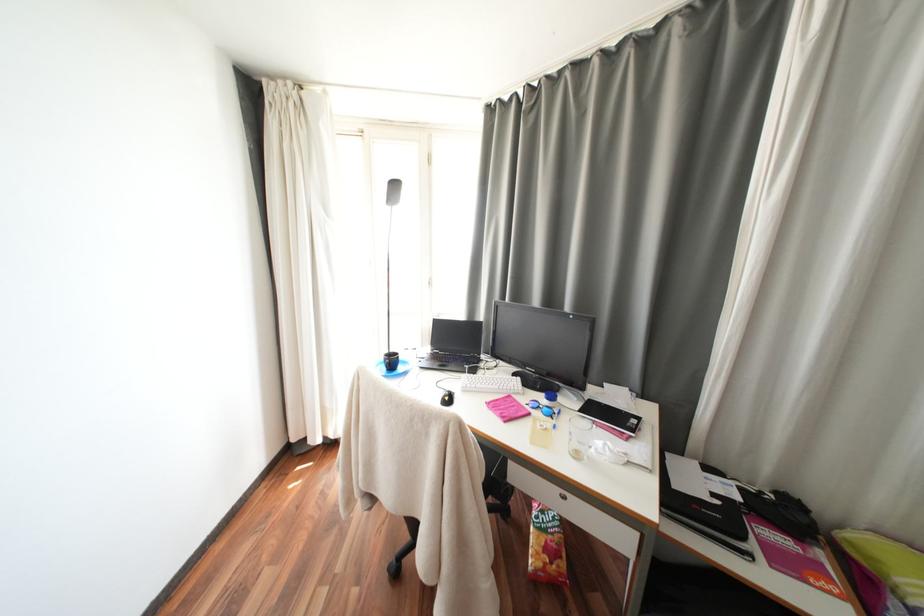
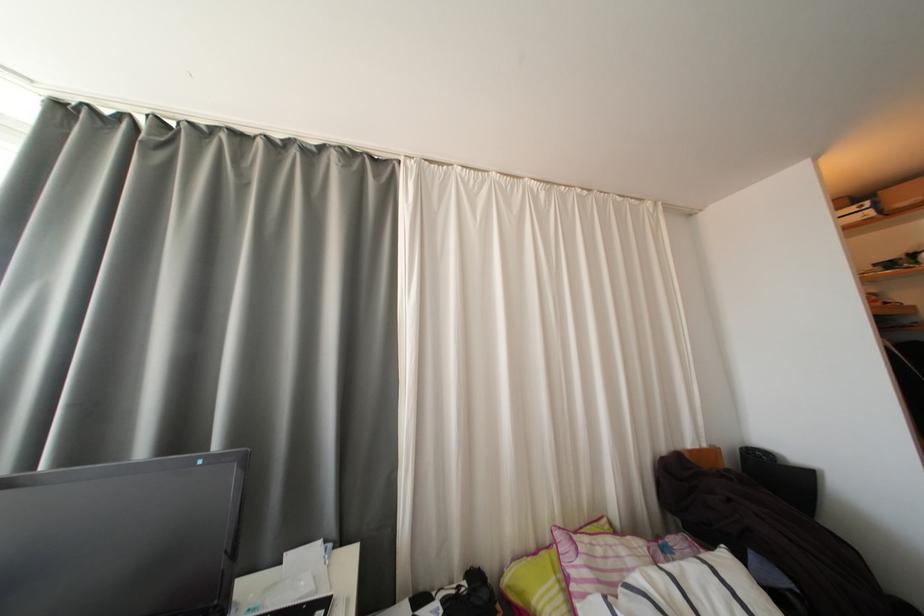
First-person continuous shooting, in which direction is the camera rotating?

The camera rotated toward right-up.